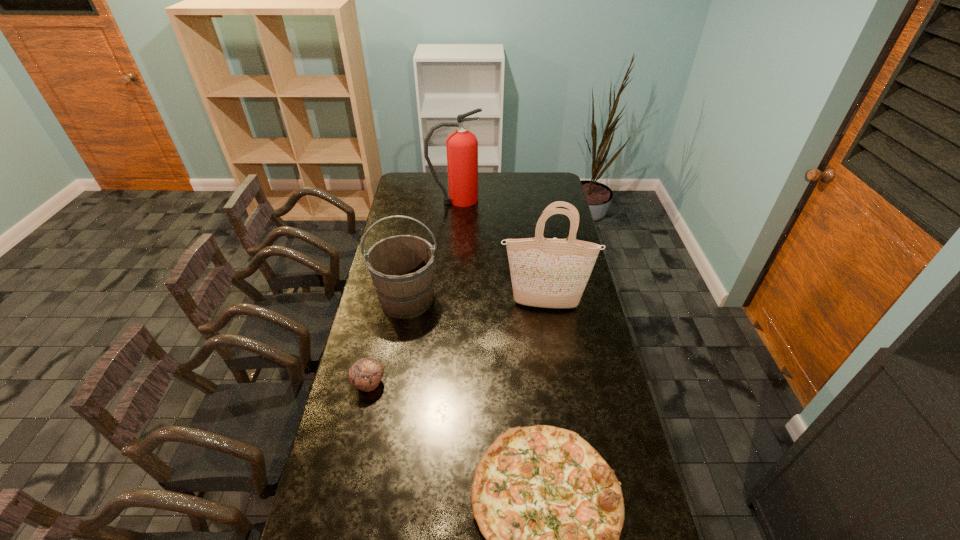
Identify the location of shopping bag. This screenshot has width=960, height=540. (550, 273).

Find the location of `the farthest object`. the farthest object is located at coordinates (462, 146).

Find the location of a particular element. the third tallest object is located at coordinates (401, 267).

Find the location of `the second nearest object`. the second nearest object is located at coordinates (365, 374).

Where is `the fourth tallest object`? The width and height of the screenshot is (960, 540). the fourth tallest object is located at coordinates (365, 374).

Image resolution: width=960 pixels, height=540 pixels. What are the coordinates of `free spot located 0.180m on the front of the shopping bag` in the screenshot? It's located at (551, 349).

Where is `free space located on the handle side of the farthest object`? The height and width of the screenshot is (540, 960). free space located on the handle side of the farthest object is located at coordinates (516, 200).

Identify the location of free space located on the front of the third shortest object. The width and height of the screenshot is (960, 540). (x=392, y=384).

This screenshot has height=540, width=960. I want to click on blank space located 0.200m on the right of the fourth tallest object, so click(x=444, y=383).

Where is `object at the far edge`? This screenshot has height=540, width=960. object at the far edge is located at coordinates (462, 146).